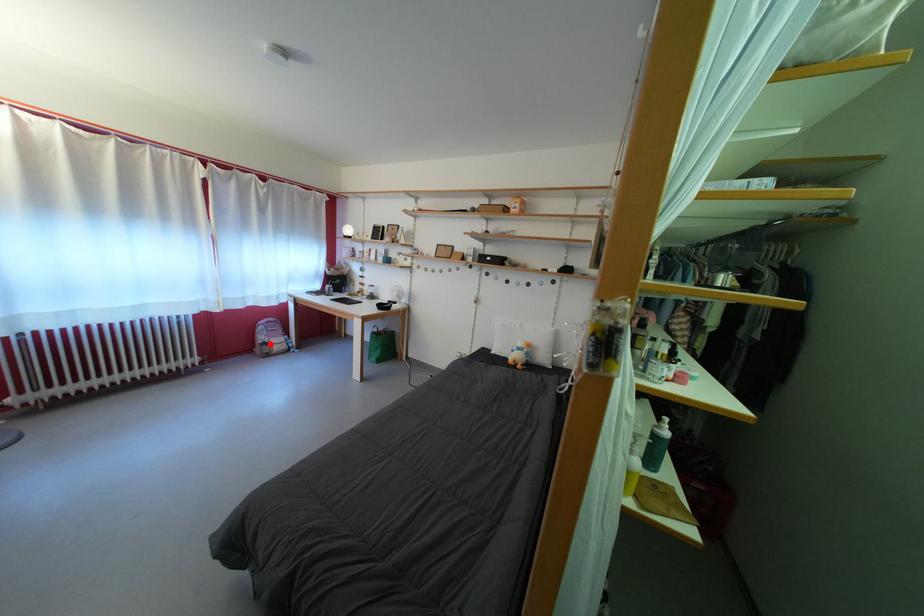
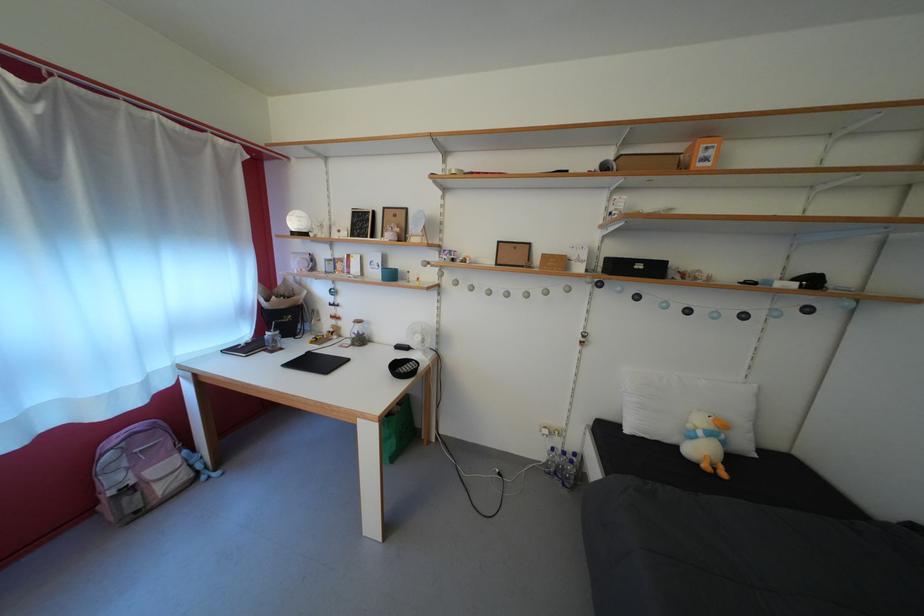
Question: A red point is marked in image1. In image2, is the corresponding 3D point closer to the camera or farther? Reply with the corresponding letter.

Choices:
 (A) The corresponding 3D point is closer.
 (B) The corresponding 3D point is farther.

Answer: (B)